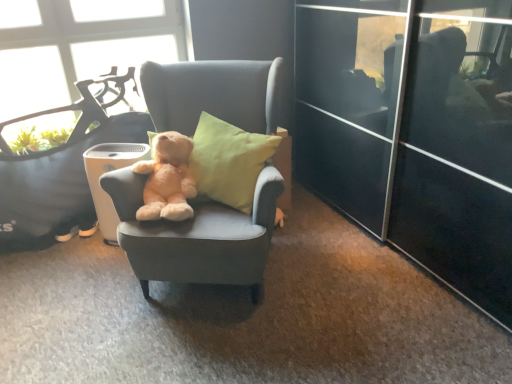
Question: Is point (179, 190) positioned closer to the camera than point (105, 137)?

Choices:
 (A) farther
 (B) closer

Answer: (B)

Question: From the image's perspective, is soft beige teddy bear at center located above or below soft gray fabric chair at center, the first chair when ordered from left to right?

Choices:
 (A) above
 (B) below

Answer: (B)

Question: Which of these objects is positioned farthest from the white plastic trash bin/can at center?

Choices:
 (A) transparent glass window at upper left
 (B) soft gray fabric chair at center, which ranks as the second chair in left-to-right order
 (C) soft gray fabric chair at center, the first chair when ordered from left to right
 (D) soft beige teddy bear at center

Answer: (A)

Question: Which object is the farthest from the soft beige teddy bear at center?

Choices:
 (A) white plastic trash bin/can at center
 (B) soft gray fabric chair at center, which ranks as the second chair in right-to-left order
 (C) soft gray fabric chair at center, which ranks as the second chair in left-to-right order
 (D) transparent glass window at upper left

Answer: (D)